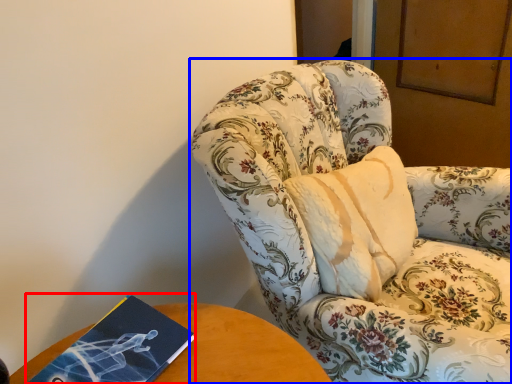
Question: Among these objects, which one is farthest to the camera, paperback book (highlighted by a red box) or chair (highlighted by a blue box)?

Choices:
 (A) paperback book
 (B) chair

Answer: (A)